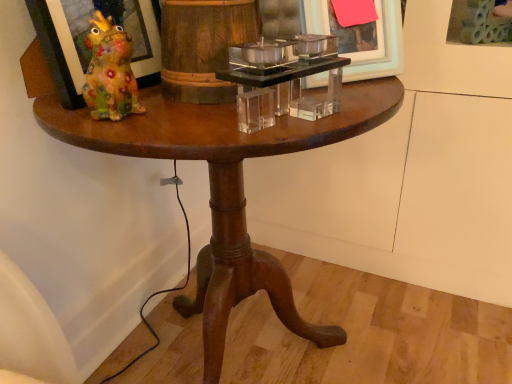
Find the location of a particular element. The image size is (512, 384). vacant area that is situated to the right of clear acrylic candle holder at center is located at coordinates (362, 108).